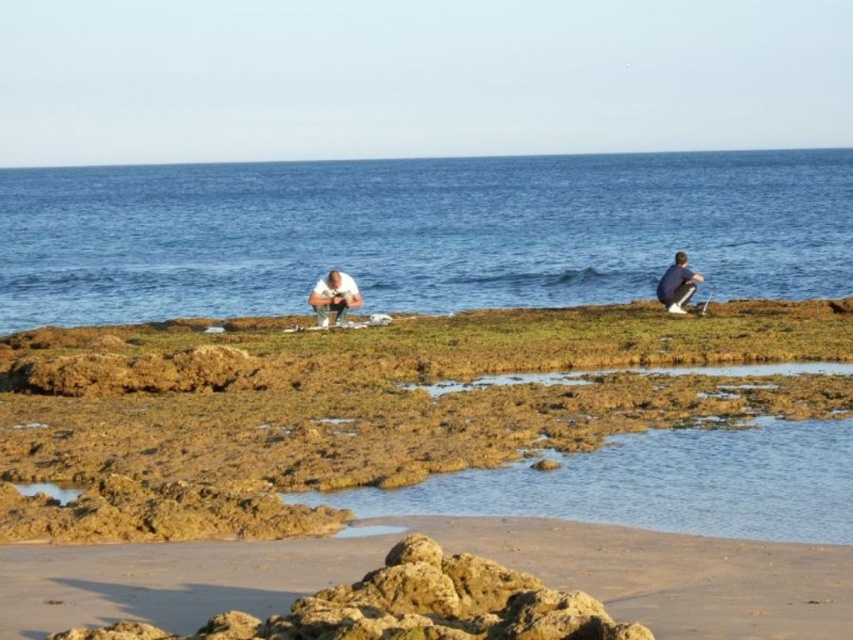
You are a photographer standing on the sandy beach at lower center and want to take a photo of the light brown leather jacket at center. Which object should you focus on first to ensure the jacket is in sharp focus?

The light brown leather jacket at center is larger than the sandy beach at lower center, so you should focus on the light brown leather jacket at center first to ensure it is in sharp focus.

You are standing on the beach and see the blue water at center and the light brown leather jacket at center. Which object is higher in the image?

The blue water at center is located above the light brown leather jacket at center, so the blue water at center is higher in the image.